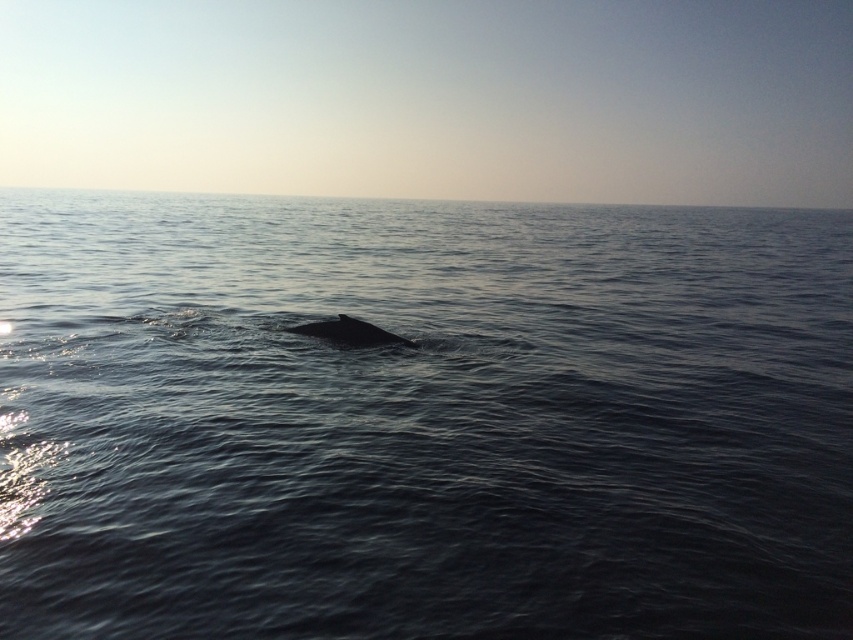
Question: Does dark blue water at center appear on the right side of gray matte whale at center?

Choices:
 (A) yes
 (B) no

Answer: (A)

Question: Which point is farther from the camera taking this photo?

Choices:
 (A) (572, 369)
 (B) (376, 328)

Answer: (B)

Question: Which object appears farthest from the camera in this image?

Choices:
 (A) dark blue water at center
 (B) gray matte whale at center

Answer: (B)

Question: In this image, where is dark blue water at center located relative to gray matte whale at center?

Choices:
 (A) above
 (B) below

Answer: (A)

Question: Which point appears closest to the camera in this image?

Choices:
 (A) (323, 291)
 (B) (378, 342)

Answer: (B)

Question: Considering the relative positions of dark blue water at center and gray matte whale at center in the image provided, where is dark blue water at center located with respect to gray matte whale at center?

Choices:
 (A) below
 (B) above

Answer: (B)